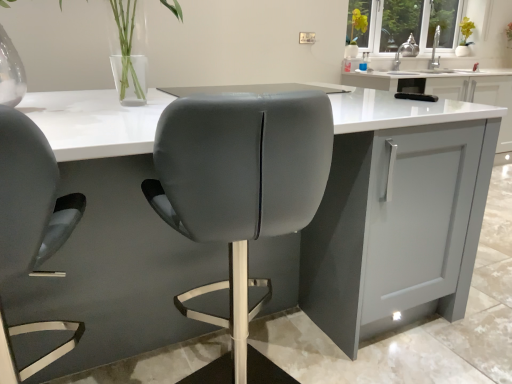
At what (x,y) coordinates should I click in order to perform the action: click on clear glass vase at upper left. Please return your answer as a coordinate pair (x, y). Looking at the image, I should click on (127, 41).

The width and height of the screenshot is (512, 384). What do you see at coordinates (127, 41) in the screenshot?
I see `clear glass vase at upper left` at bounding box center [127, 41].

The height and width of the screenshot is (384, 512). I want to click on clear glass vase at upper left, so point(127,41).